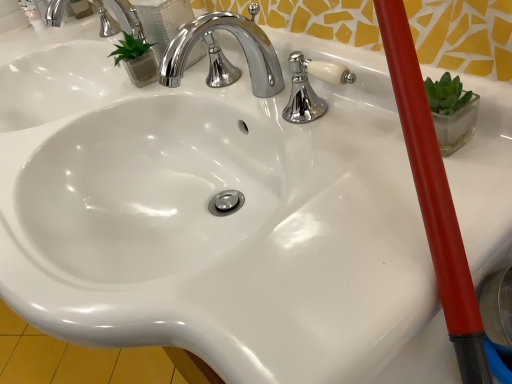
Question: Should I look upward or downward to see chrome/metallic faucet at center, which is the 2th tap from left to right?

Choices:
 (A) down
 (B) up

Answer: (B)

Question: Can you confirm if chrome/metallic faucet at center, the second tap positioned from the top, is bigger than polished chrome faucet at upper center, which is the 2th tap in front-to-back order?

Choices:
 (A) no
 (B) yes

Answer: (A)

Question: Are chrome/metallic faucet at center, the 1th tap in the right-to-left sequence, and polished chrome faucet at upper center, which appears as the 1th tap when viewed from the top, making contact?

Choices:
 (A) yes
 (B) no

Answer: (B)

Question: From a real-world perspective, is chrome/metallic faucet at center, acting as the 2th tap starting from the back, on top of polished chrome faucet at upper center, which appears as the 1th tap when viewed from the left?

Choices:
 (A) yes
 (B) no

Answer: (B)

Question: Considering the relative sizes of chrome/metallic faucet at center, the 1th tap in the right-to-left sequence, and polished chrome faucet at upper center, which appears as the 1th tap when viewed from the left, in the image provided, is chrome/metallic faucet at center, the 1th tap in the right-to-left sequence, thinner than polished chrome faucet at upper center, which appears as the 1th tap when viewed from the left,?

Choices:
 (A) yes
 (B) no

Answer: (B)

Question: Does chrome/metallic faucet at center, which is the 2th tap from left to right, come in front of polished chrome faucet at upper center, which is the 2th tap in front-to-back order?

Choices:
 (A) yes
 (B) no

Answer: (A)

Question: Is chrome/metallic faucet at center, the second tap positioned from the top, positioned with its back to polished chrome faucet at upper center, which appears as the 1th tap when viewed from the left?

Choices:
 (A) no
 (B) yes

Answer: (A)

Question: From a real-world perspective, is polished chrome faucet at upper center, the second tap when ordered from right to left, over chrome/metallic faucet at center, the 1th tap in the right-to-left sequence?

Choices:
 (A) no
 (B) yes

Answer: (B)

Question: From the image's perspective, is polished chrome faucet at upper center, which is the first tap from back to front, on top of chrome/metallic faucet at center, placed as the first tap when sorted from bottom to top?

Choices:
 (A) no
 (B) yes

Answer: (B)

Question: Is polished chrome faucet at upper center, which appears as the 1th tap when viewed from the left, not close to chrome/metallic faucet at center, which is the 2th tap from left to right?

Choices:
 (A) no
 (B) yes

Answer: (A)

Question: Considering the relative sizes of polished chrome faucet at upper center, which appears as the 1th tap when viewed from the top, and chrome/metallic faucet at center, which is the 2th tap from left to right, in the image provided, is polished chrome faucet at upper center, which appears as the 1th tap when viewed from the top, smaller than chrome/metallic faucet at center, which is the 2th tap from left to right,?

Choices:
 (A) yes
 (B) no

Answer: (B)

Question: Does polished chrome faucet at upper center, which appears as the 1th tap when viewed from the left, appear on the right side of chrome/metallic faucet at center, acting as the 2th tap starting from the back?

Choices:
 (A) no
 (B) yes

Answer: (A)

Question: Does polished chrome faucet at upper center, which is the 2th tap in front-to-back order, have a greater width compared to chrome/metallic faucet at center, which is the 2th tap from left to right?

Choices:
 (A) no
 (B) yes

Answer: (A)

Question: From a real-world perspective, is polished chrome faucet at upper center, which appears as the 1th tap when viewed from the top, positioned above or below chrome/metallic faucet at center, the 1th tap in the right-to-left sequence?

Choices:
 (A) above
 (B) below

Answer: (A)